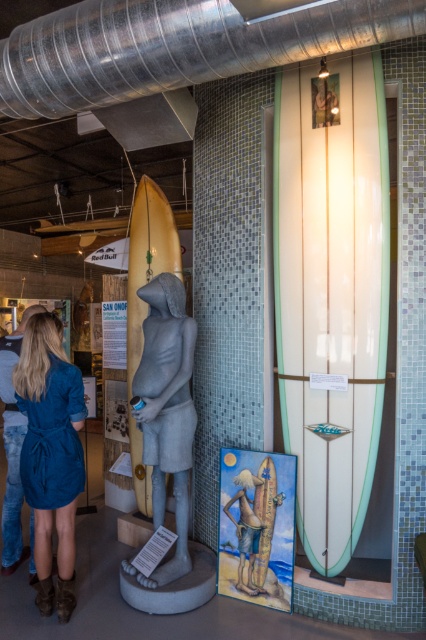
You are a visitor in the exhibit and want to take a photo of the gray stone statue at center without the blue denim dress at lower left blocking the view. Is this possible from your current position?

The blue denim dress at lower left is in front of the gray stone statue at center, so you cannot take a photo of the gray stone statue at center without the blue denim dress at lower left blocking the view from your current position. Move to a different angle where the dress is not in front.

You are a museum visitor who wants to take a photo of both the blue denim dress at lower left and the beige fabric surfboard at center in the same frame. Based on their current positions, do you think they can both fit in your camera viewfinder?

The blue denim dress at lower left and beige fabric surfboard at center are 36.12 inches apart. Since the distance between them is known, you can adjust your camera angle or step back slightly to ensure both items are within the viewfinder.